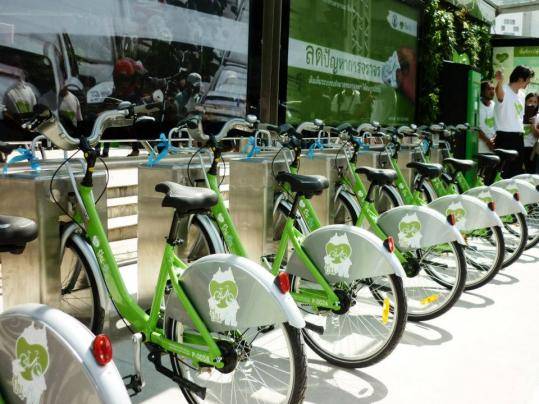
Image resolution: width=539 pixels, height=404 pixels. I want to click on seat, so click(23, 235), click(190, 196), click(305, 184), click(380, 176), click(425, 170), click(466, 164), click(487, 159), click(509, 153).